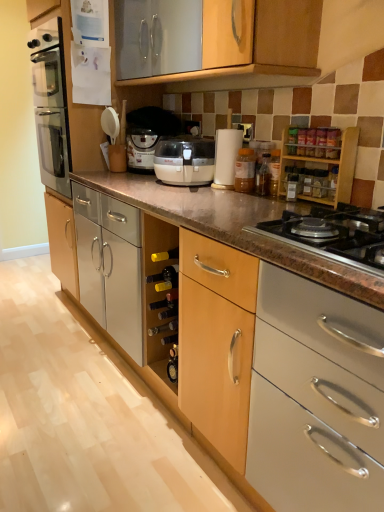
What do you see at coordinates (260, 350) in the screenshot?
I see `wooden cabinet at lower center, which is the second cabinetry in right-to-left order` at bounding box center [260, 350].

What are the coordinates of `translucent plastic jar at center` in the screenshot? It's located at (245, 170).

What do you see at coordinates (319, 164) in the screenshot? I see `wooden spice rack at upper right, the second cabinetry positioned from the left` at bounding box center [319, 164].

This screenshot has width=384, height=512. What are the coordinates of `wooden cabinet at lower center, which is the 2th cabinetry from back to front` in the screenshot? It's located at (260, 350).

Which of these two, wooden cabinet at lower center, which is the 2th cabinetry from back to front, or black granite gas stove at lower right, is thinner?

black granite gas stove at lower right.

Is wooden cabinet at lower center, which is counted as the 1th cabinetry, starting from the front, not near black granite gas stove at lower right?

Actually, wooden cabinet at lower center, which is counted as the 1th cabinetry, starting from the front, and black granite gas stove at lower right are a little close together.

Is point (199, 275) behind point (369, 242)?

Yes.

The width and height of the screenshot is (384, 512). In order to click on gas stove on the right of wooden cabinet at lower center, which is the second cabinetry in right-to-left order in this screenshot , I will do `click(333, 234)`.

Can you confirm if black granite gas stove at lower right is taller than matte white coffee machine at center?

No.

Can you confirm if black granite gas stove at lower right is smaller than matte white coffee machine at center?

Correct, black granite gas stove at lower right occupies less space than matte white coffee machine at center.

Locate an element on the screen. The image size is (384, 512). coffee machine above the black granite gas stove at lower right (from a real-world perspective) is located at coordinates (148, 134).

Can you confirm if black granite gas stove at lower right is positioned to the left of matte white coffee machine at center?

In fact, black granite gas stove at lower right is to the right of matte white coffee machine at center.

Can you see wooden spice rack at upper right, the first cabinetry in the top-to-bottom sequence, touching translucent plastic jar at center?

No.

Measure the distance from wooden spice rack at upper right, the first cabinetry in the top-to-bottom sequence, to translucent plastic jar at center.

wooden spice rack at upper right, the first cabinetry in the top-to-bottom sequence, is 10.58 inches away from translucent plastic jar at center.

How many degrees apart are the facing directions of wooden spice rack at upper right, the first cabinetry in the top-to-bottom sequence, and translucent plastic jar at center?

There is a 1.17-degree angle between the facing directions of wooden spice rack at upper right, the first cabinetry in the top-to-bottom sequence, and translucent plastic jar at center.

Considering the relative positions of wooden spice rack at upper right, the first cabinetry in the top-to-bottom sequence, and translucent plastic jar at center in the image provided, is wooden spice rack at upper right, the first cabinetry in the top-to-bottom sequence, to the right of translucent plastic jar at center from the viewer's perspective?

Yes.

Between translucent plastic jar at center and wooden cabinet at lower center, which is the 2th cabinetry from back to front, which one has less height?

wooden cabinet at lower center, which is the 2th cabinetry from back to front, is shorter.

How many degrees apart are the facing directions of translucent plastic jar at center and wooden cabinet at lower center, positioned as the first cabinetry in bottom-to-top order?

There is a 87.8-degree angle between the facing directions of translucent plastic jar at center and wooden cabinet at lower center, positioned as the first cabinetry in bottom-to-top order.

Which is more to the right, translucent plastic jar at center or wooden cabinet at lower center, which is counted as the 1th cabinetry, starting from the front?

Positioned to the right is translucent plastic jar at center.

You are a GUI agent. You are given a task and a screenshot of the screen. Output one action in this format:
    pyautogui.click(x=<x>, y=<y>)
    Task: Click on the bottle above the wooden cabinet at lower center, which is the second cabinetry in right-to-left order (from the image's perspective)
    
    Given the screenshot: What is the action you would take?
    pyautogui.click(x=245, y=170)

Is matte white coffee machine at center not near black granite gas stove at lower right?

Yes, matte white coffee machine at center and black granite gas stove at lower right are located far from each other.

From a real-world perspective, does matte white coffee machine at center stand above black granite gas stove at lower right?

Indeed, from a real-world perspective, matte white coffee machine at center stands above black granite gas stove at lower right.

Considering the sizes of objects matte white coffee machine at center and black granite gas stove at lower right in the image provided, who is taller, matte white coffee machine at center or black granite gas stove at lower right?

matte white coffee machine at center is taller.

In the scene shown: Is matte white coffee machine at center located outside black granite gas stove at lower right?

matte white coffee machine at center is positioned outside black granite gas stove at lower right.

Can you tell me how much wooden spice rack at upper right, the first cabinetry in the top-to-bottom sequence, and matte white coffee machine at center differ in facing direction?

wooden spice rack at upper right, the first cabinetry in the top-to-bottom sequence, and matte white coffee machine at center are facing 1.28 degrees away from each other.

Is wooden spice rack at upper right, the second cabinetry positioned from the left, not near matte white coffee machine at center?

No, wooden spice rack at upper right, the second cabinetry positioned from the left, is not far away from matte white coffee machine at center.

In the scene shown: Is wooden spice rack at upper right, the first cabinetry in the top-to-bottom sequence, facing towards matte white coffee machine at center?

No.

Does wooden spice rack at upper right, the first cabinetry in the top-to-bottom sequence, have a smaller size compared to matte white coffee machine at center?

Yes.

Between wooden spice rack at upper right, positioned as the 1th cabinetry in back-to-front order, and wooden cabinet at lower center, which is the 2th cabinetry from back to front, which one is positioned in front?

Positioned in front is wooden cabinet at lower center, which is the 2th cabinetry from back to front.

From the image's perspective, who appears lower, wooden spice rack at upper right, arranged as the second cabinetry when viewed from the front, or wooden cabinet at lower center, which is the 2th cabinetry from back to front?

From the image's view, wooden cabinet at lower center, which is the 2th cabinetry from back to front, is below.

Which of these two, wooden spice rack at upper right, the second cabinetry positioned from the left, or wooden cabinet at lower center, the 2th cabinetry when ordered from top to bottom, stands taller?

Standing taller between the two is wooden spice rack at upper right, the second cabinetry positioned from the left.

Where is `cabinetry lying below the black granite gas stove at lower right (from the image's perspective)`? cabinetry lying below the black granite gas stove at lower right (from the image's perspective) is located at coordinates (260, 350).

The height and width of the screenshot is (512, 384). What are the coordinates of `gas stove below the matte white coffee machine at center (from a real-world perspective)` in the screenshot? It's located at (333, 234).

Considering their positions, is wooden cabinet at lower center, arranged as the first cabinetry when viewed from the left, positioned further to matte white coffee machine at center than wooden spice rack at upper right, which ranks as the 2th cabinetry in bottom-to-top order?

Based on the image, wooden cabinet at lower center, arranged as the first cabinetry when viewed from the left, appears to be further to matte white coffee machine at center.

Looking at the image, which one is located further to wooden spice rack at upper right, the first cabinetry in the top-to-bottom sequence, translucent plastic jar at center or wooden cabinet at lower center, positioned as the first cabinetry in bottom-to-top order?

Based on the image, wooden cabinet at lower center, positioned as the first cabinetry in bottom-to-top order, appears to be further to wooden spice rack at upper right, the first cabinetry in the top-to-bottom sequence.

In the scene shown: Which object lies nearer to the anchor point wooden cabinet at lower center, which is the 2th cabinetry from back to front, matte white coffee machine at center or translucent plastic jar at center?

Among the two, translucent plastic jar at center is located nearer to wooden cabinet at lower center, which is the 2th cabinetry from back to front.

Considering their positions, is wooden cabinet at lower center, the 2th cabinetry when ordered from top to bottom, positioned closer to wooden spice rack at upper right, positioned as the 1th cabinetry in back-to-front order, than translucent plastic jar at center?

Based on the image, translucent plastic jar at center appears to be nearer to wooden spice rack at upper right, positioned as the 1th cabinetry in back-to-front order.

Considering their positions, is translucent plastic jar at center positioned further to black granite gas stove at lower right than matte white coffee machine at center?

Based on the image, matte white coffee machine at center appears to be further to black granite gas stove at lower right.

Looking at the image, which one is located closer to matte white coffee machine at center, black granite gas stove at lower right or translucent plastic jar at center?

Based on the image, translucent plastic jar at center appears to be nearer to matte white coffee machine at center.

Which object lies further to the anchor point black granite gas stove at lower right, matte white coffee machine at center or wooden cabinet at lower center, which is counted as the 1th cabinetry, starting from the front?

Among the two, matte white coffee machine at center is located further to black granite gas stove at lower right.

Considering their positions, is wooden cabinet at lower center, arranged as the first cabinetry when viewed from the left, positioned further to translucent plastic jar at center than black granite gas stove at lower right?

The object further to translucent plastic jar at center is wooden cabinet at lower center, arranged as the first cabinetry when viewed from the left.

The height and width of the screenshot is (512, 384). I want to click on bottle located between wooden spice rack at upper right, the second cabinetry positioned from the left, and matte white coffee machine at center in the depth direction, so click(245, 170).

Locate an element on the screen. The height and width of the screenshot is (512, 384). bottle located between wooden cabinet at lower center, which is the 2th cabinetry from back to front, and black granite gas stove at lower right in the left-right direction is located at coordinates (245, 170).

Image resolution: width=384 pixels, height=512 pixels. I want to click on cabinetry between wooden cabinet at lower center, arranged as the first cabinetry when viewed from the left, and black granite gas stove at lower right, so [319, 164].

Identify the location of bottle between wooden cabinet at lower center, the 2th cabinetry when ordered from top to bottom, and wooden spice rack at upper right, which ranks as the 2th cabinetry in bottom-to-top order. tap(245, 170).